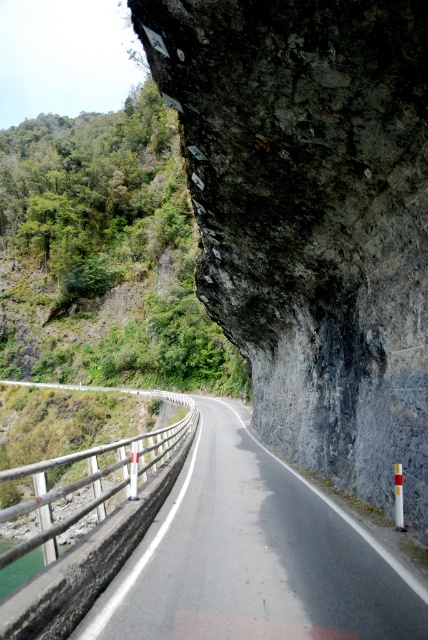
You are a hiker standing at the point marked by the coordinates point (106, 253). Looking towards the winding road ahead, which direction should you go to reach the metal guardrail on the left side of the road?

The point (106, 253) marks green leafy hillside at upper left. To reach the metal guardrail on the left side of the road, you should head towards the lower right direction since the road curves gently to the left and the guardrail is on the left side of the road.

You are a delivery truck driver who needs to navigate a narrow road. The truck is 12 feet wide. The scene shows a green leafy hillside at upper left and an asphalt road at center. Can the truck safely pass through the road without hitting the hillside?

The distance between the green leafy hillside at upper left and the asphalt road at center is 310.25 feet. Since the truck is only 12 feet wide, there is more than enough space for it to pass safely without hitting the hillside.

You are a hiker planning to take a photo of the green leafy hillside at upper left from the road. Given that the road curves gently to the left and the guardrail is on the left side, where should you position yourself to get the best view of the hillside without crossing the guardrail?

To capture the green leafy hillside at upper left effectively, position yourself on the right side of the road near the guardrail. Since the road curves left and the guardrail is on the left, staying on the right allows a clear view of the hillside while remaining safe behind the guardrail.